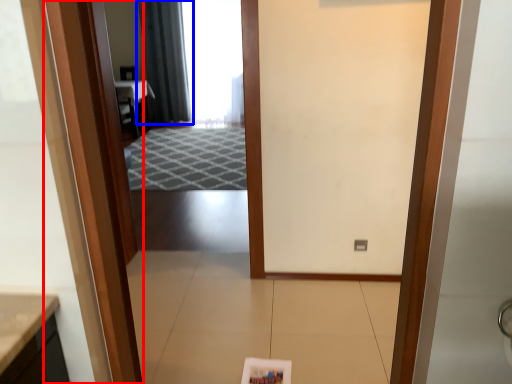
Question: Which object is further to the camera taking this photo, door (highlighted by a red box) or curtain (highlighted by a blue box)?

Choices:
 (A) door
 (B) curtain

Answer: (B)